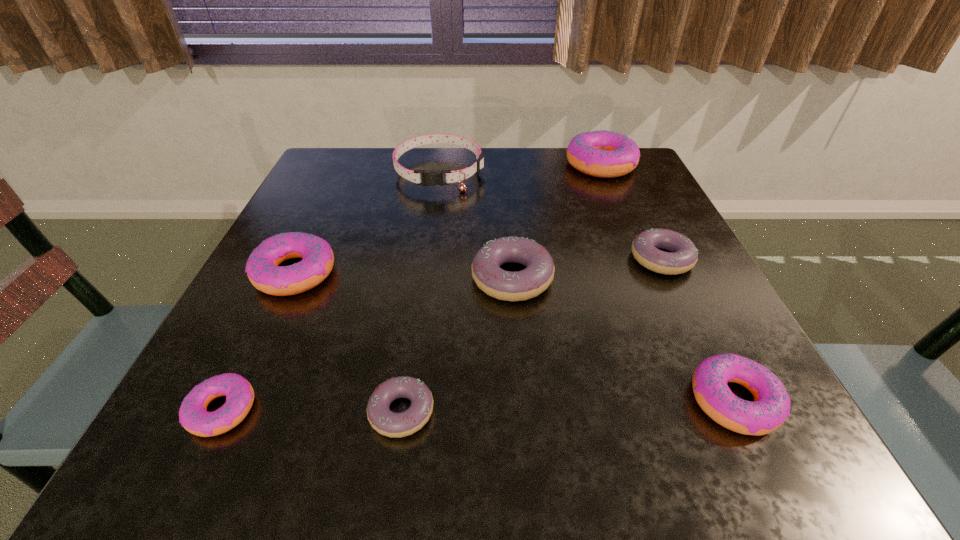
Where is `object that is the second closest to the biggest purple doughnut`? The image size is (960, 540). object that is the second closest to the biggest purple doughnut is located at coordinates (395, 425).

Locate an element on the screen. object that stands as the fifth closest to the dog collar is located at coordinates (395, 425).

Locate which doughnut is the closest to the rightmost purple doughnut. Please provide its 2D coordinates. Your answer should be formatted as a tuple, i.e. [(x, y)], where the tuple contains the x and y coordinates of a point satisfying the conditions above.

[(522, 285)]

Identify which doughnut is located as the seventh nearest to the dog collar. Please provide its 2D coordinates. Your answer should be formatted as a tuple, i.e. [(x, y)], where the tuple contains the x and y coordinates of a point satisfying the conditions above.

[(771, 406)]

Identify which pink doughnut is located as the fourth nearest to the second smallest purple doughnut. Please provide its 2D coordinates. Your answer should be formatted as a tuple, i.e. [(x, y)], where the tuple contains the x and y coordinates of a point satisfying the conditions above.

[(193, 416)]

The image size is (960, 540). I want to click on pink doughnut that can be found as the second closest to the third doughnut from left to right, so click(262, 268).

This screenshot has height=540, width=960. I want to click on the closest purple doughnut relative to the second biggest pink doughnut, so click(x=395, y=425).

Image resolution: width=960 pixels, height=540 pixels. In order to click on purple doughnut identified as the closest to the second smallest purple doughnut in this screenshot , I will do `click(522, 285)`.

The width and height of the screenshot is (960, 540). I want to click on vacant space that satisfies the following two spatial constraints: 1. with the buckle on the second biggest purple doughnut; 2. on the left side of the dog collar, so click(x=427, y=259).

Where is `free space in the image that satisfies the following two spatial constraints: 1. with the buckle on the third biggest pink doughnut; 2. on the left side of the pink dog collar`? This screenshot has width=960, height=540. free space in the image that satisfies the following two spatial constraints: 1. with the buckle on the third biggest pink doughnut; 2. on the left side of the pink dog collar is located at coordinates (408, 400).